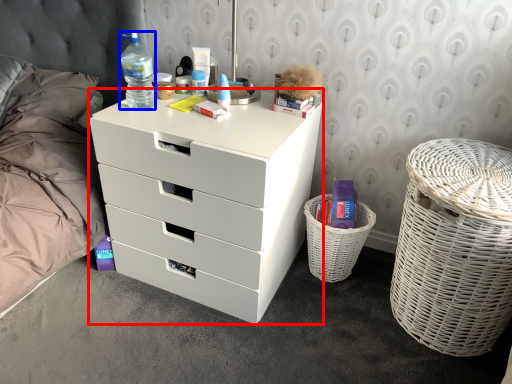
Question: Among these objects, which one is nearest to the camera, chest of drawers (highlighted by a red box) or bottle (highlighted by a blue box)?

Choices:
 (A) chest of drawers
 (B) bottle

Answer: (A)